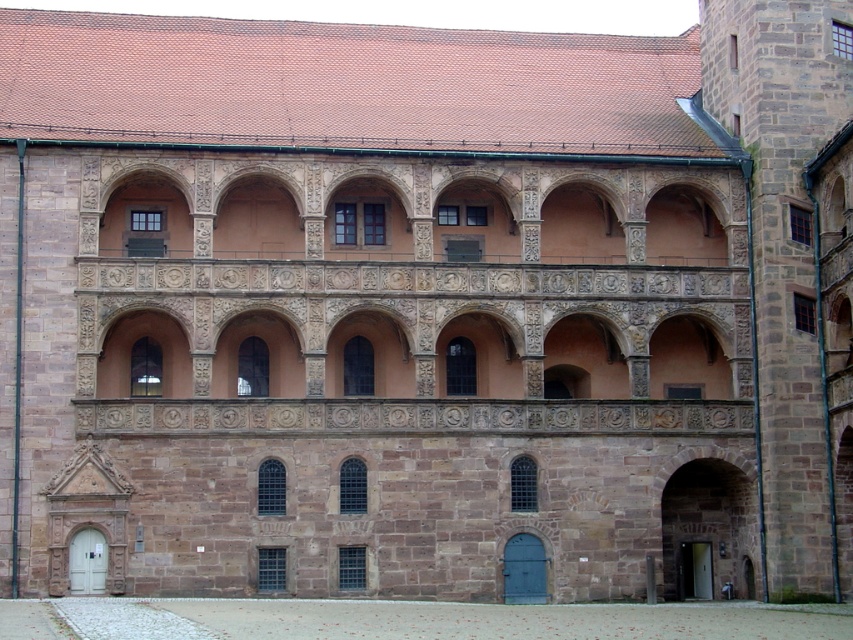
You are standing in the smooth gravel courtyard at lower center and want to exit through the stone archway at lower right. Which direction should you walk to reach the archway?

Since the smooth gravel courtyard at lower center is in front of the stone archway at lower right, you should walk backward to reach the stone archway at lower right from your current position.

You are a visitor standing in the smooth gravel courtyard at lower center and want to exit through the stone archway at lower right. Which direction should you move to reach the archway?

The smooth gravel courtyard at lower center is positioned on the left side of the stone archway at lower right, so you should move to the right to reach the archway.

You are standing at point (276, 609) and want to walk to the other side of the building. The building is 178.66 feet wide. Can you walk around the building without crossing the road?

The distance between you and the other side of the building is 178.66 feet. Since the building is 178.66 feet wide, you can walk around it without crossing the road by going along the side.